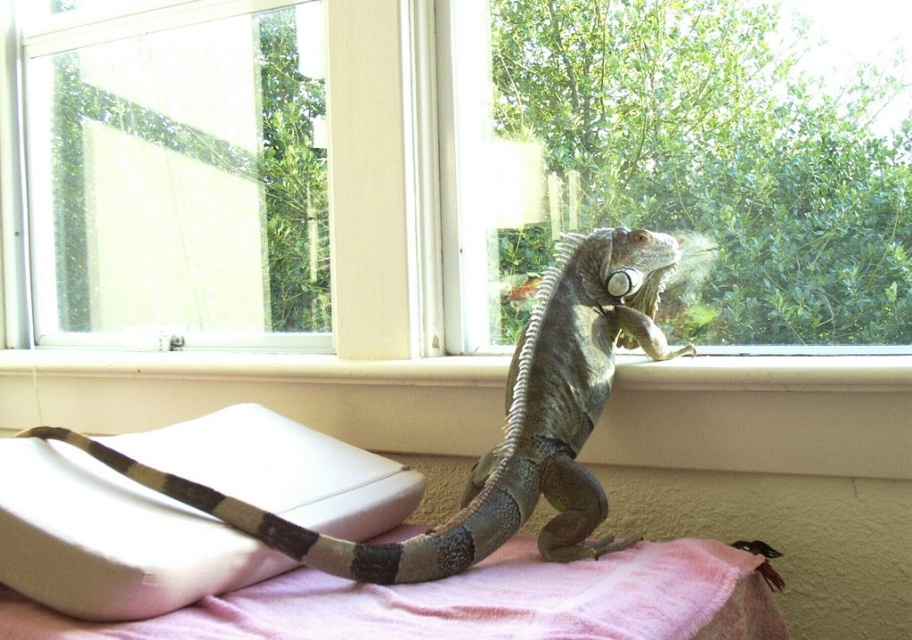
Question: Is smooth white window sill at center above pink fabric bed at lower center?

Choices:
 (A) yes
 (B) no

Answer: (A)

Question: Which object is the closest to the white foam pillow at lower left?

Choices:
 (A) smooth white window sill at center
 (B) pink fabric bed at lower center
 (C) green scaly lizard at upper center

Answer: (C)

Question: Does white foam pillow at lower left have a lesser width compared to green scaly lizard at upper center?

Choices:
 (A) no
 (B) yes

Answer: (B)

Question: Does green scaly lizard at upper center appear under pink fabric bed at lower center?

Choices:
 (A) yes
 (B) no

Answer: (B)

Question: Which object is positioned farthest from the smooth white window sill at center?

Choices:
 (A) pink fabric bed at lower center
 (B) green scaly lizard at upper center

Answer: (A)

Question: Which point is farther to the camera?

Choices:
 (A) (614, 298)
 (B) (30, 468)
 (C) (610, 632)

Answer: (A)